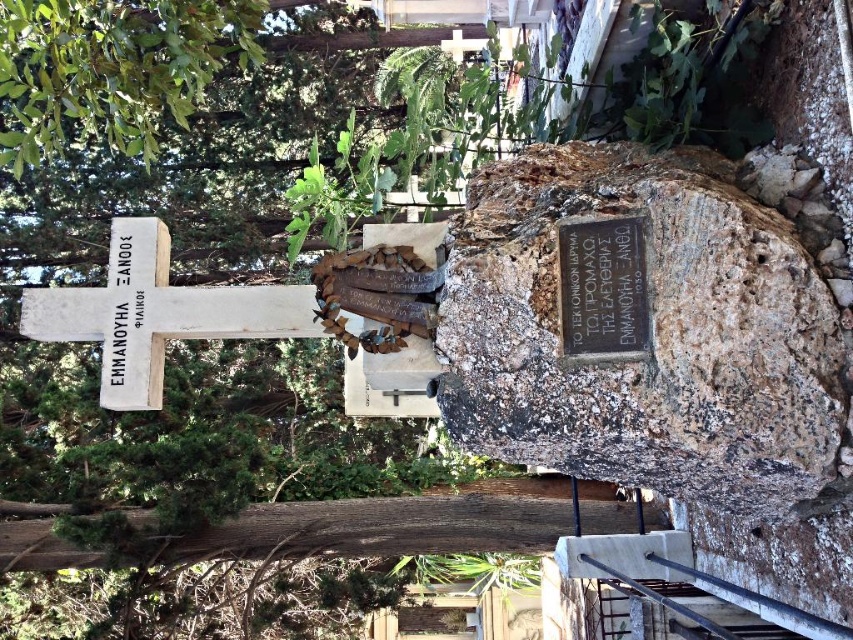
Who is positioned more to the left, rusty stone plaque at center or bronze plaque at center?

Positioned to the left is bronze plaque at center.

Is rusty stone plaque at center behind bronze plaque at center?

No.

Locate an element on the screen. The height and width of the screenshot is (640, 853). rusty stone plaque at center is located at coordinates (648, 333).

The width and height of the screenshot is (853, 640). What are the coordinates of `rusty stone plaque at center` in the screenshot? It's located at (648, 333).

Which of these two, rusty stone plaque at center or white stone cross at left, stands taller?

Standing taller between the two is rusty stone plaque at center.

Between rusty stone plaque at center and white stone cross at left, which one is positioned higher?

rusty stone plaque at center is higher up.

Between point (730, 230) and point (102, 385), which one is positioned behind?

The point (102, 385) is behind.

The width and height of the screenshot is (853, 640). I want to click on rusty stone plaque at center, so click(x=648, y=333).

Is rusty stone plaque at center thinner than white stone cross at upper left?

Incorrect, rusty stone plaque at center's width is not less than white stone cross at upper left's.

Does rusty stone plaque at center have a greater height compared to white stone cross at upper left?

Yes.

Identify the location of rusty stone plaque at center. Image resolution: width=853 pixels, height=640 pixels. (648, 333).

At what (x,y) coordinates should I click in order to perform the action: click on rusty stone plaque at center. Please return your answer as a coordinate pair (x, y). Image resolution: width=853 pixels, height=640 pixels. Looking at the image, I should click on (648, 333).